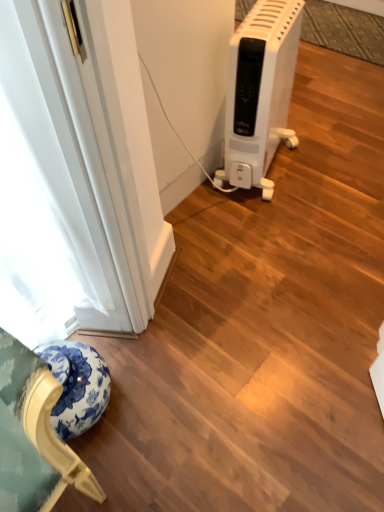
Locate an element on the screen. The image size is (384, 512). vacant area located to the right-hand side of blue and white ceramic swivel chair at lower left is located at coordinates (142, 382).